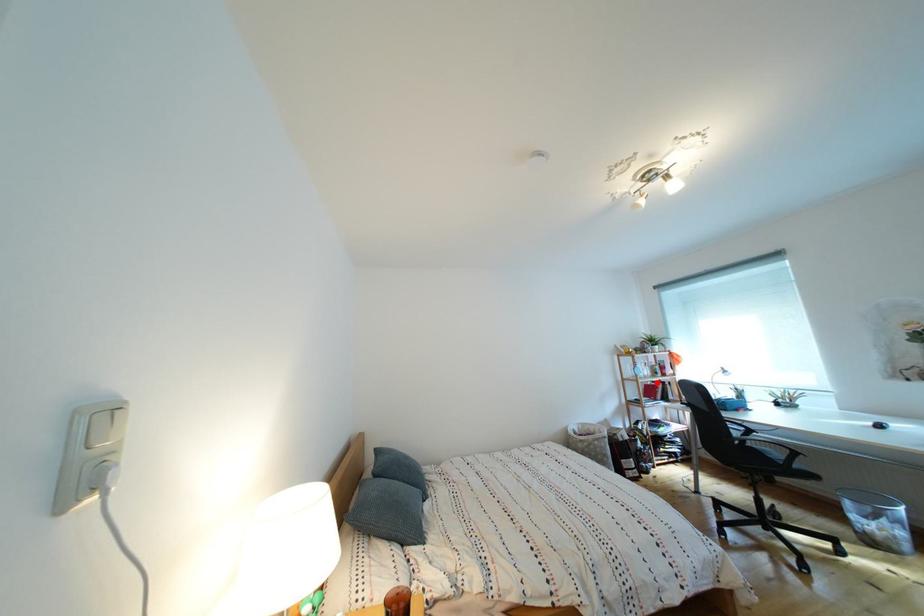
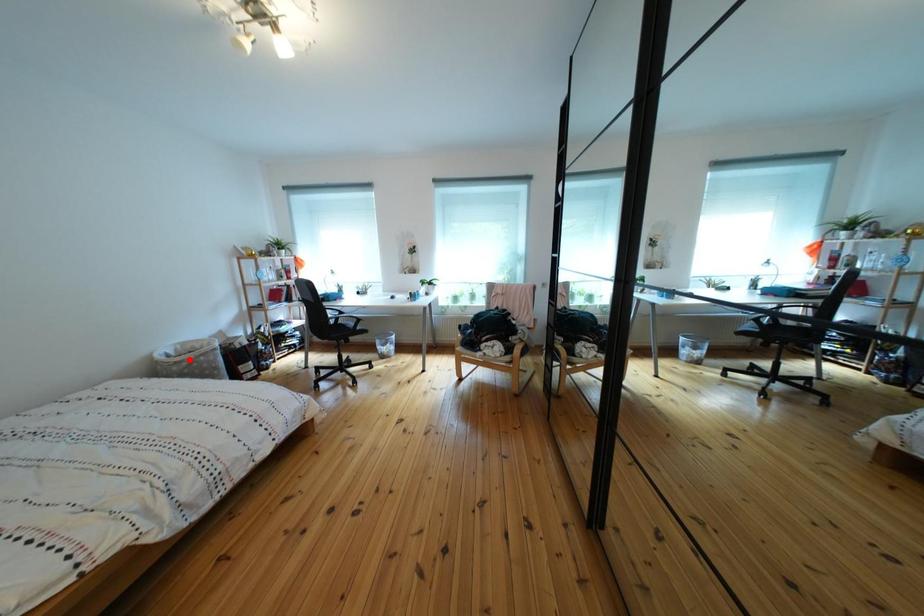
I am providing you with two images of the same scene from different viewpoints. A red point is marked on the first image and another point is marked on the second image. Are the points marked in image1 and image2 representing the same 3D position?

No